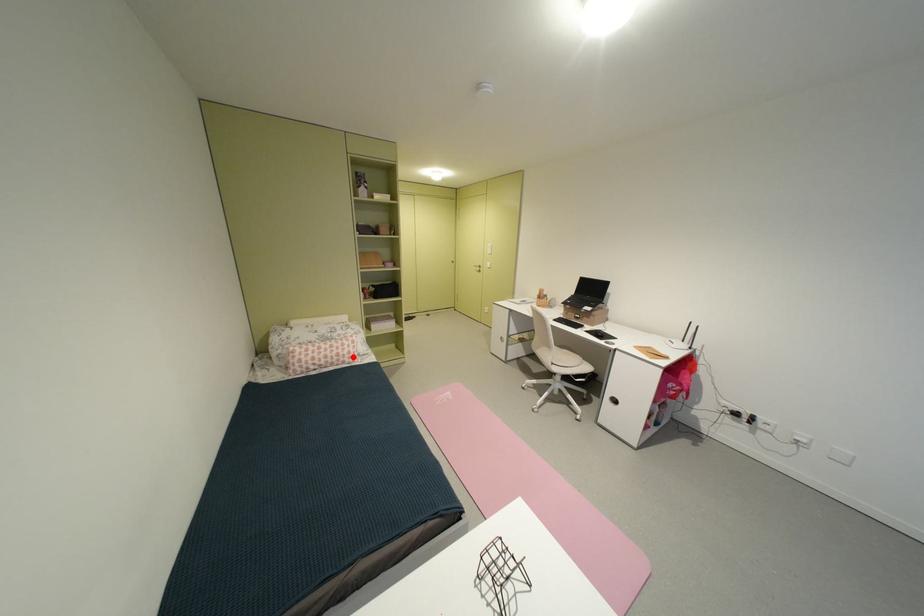
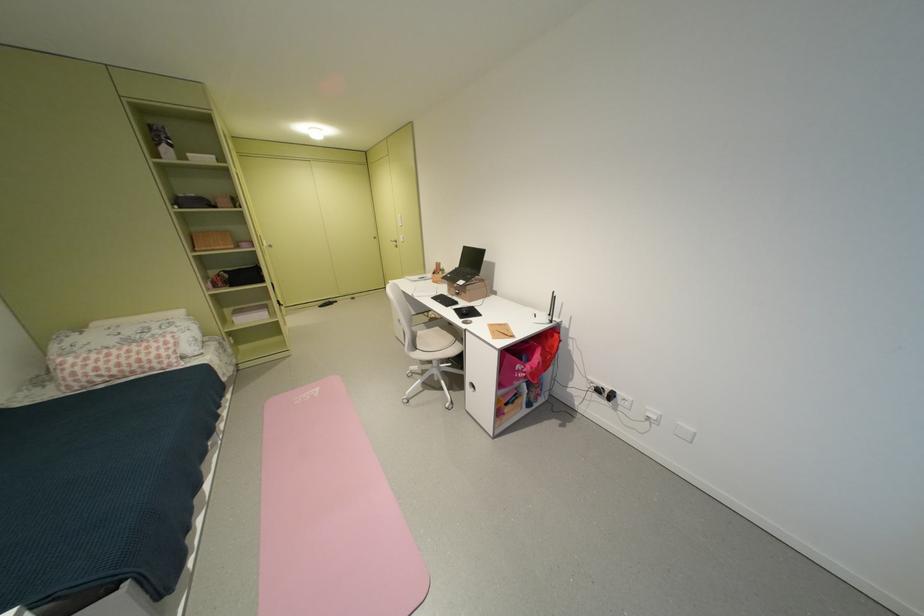
Question: I am providing you with two images of the same scene from different viewpoints. A red point is marked on the first image. Can you still see the location of the red point in image 2?

Choices:
 (A) Yes
 (B) No

Answer: (A)